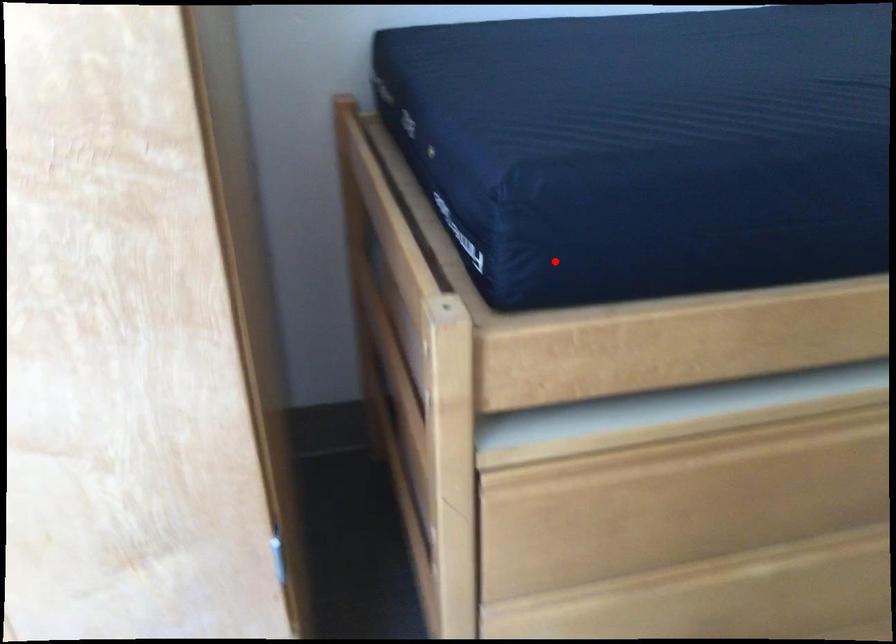
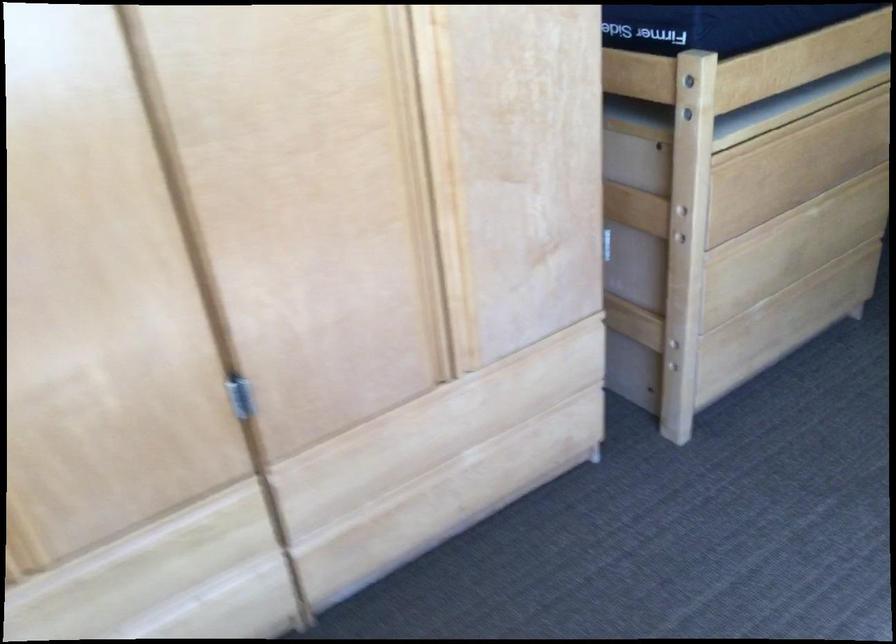
The point at the highlighted location is marked in the first image. Where is the corresponding point in the second image?

(718, 24)